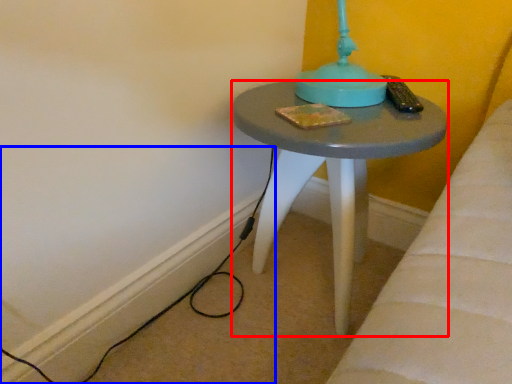
Question: Which of the following is the farthest to the observer, stool (highlighted by a red box) or cable (highlighted by a blue box)?

Choices:
 (A) stool
 (B) cable

Answer: (B)